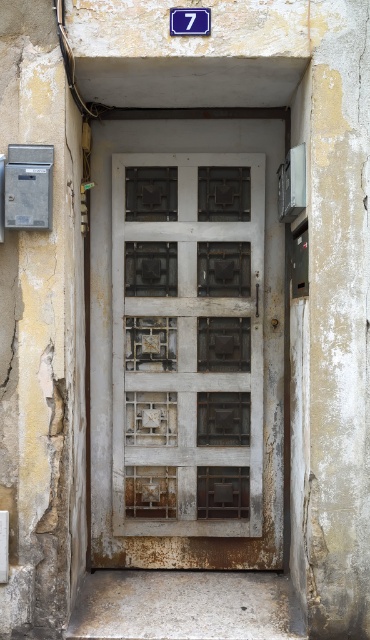
You are standing in front of the white wooden door at center and the blue plastic sign at upper center. Which object is closer to you?

The white wooden door at center is closer to you than the blue plastic sign at upper center.

You are standing in front of the weathered door and need to enter. The door has a grid pattern with some sections having a more intricate lattice. Can you determine the exact coordinates of the white wooden door at center to ensure you approach it correctly?

The white wooden door at center is located at coordinates point (187, 342), so you should approach it directly at those coordinates to ensure proper entry.

You are a delivery person trying to locate the correct apartment. You see the white wooden door at center and the blue plastic sign at upper center. Which object is positioned higher up in the image?

The blue plastic sign at upper center is positioned higher up in the image than the white wooden door at center.